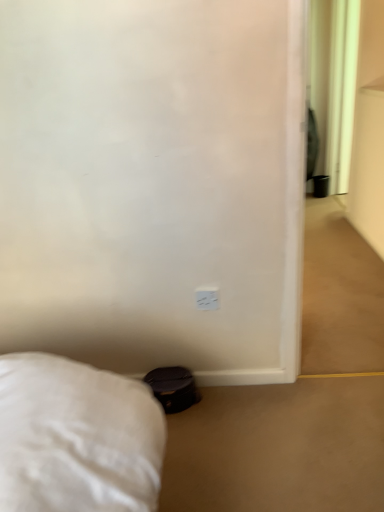
At what (x,y) coordinates should I click in order to perform the action: click on white glossy electric outlet at center. Please return your answer as a coordinate pair (x, y). This screenshot has width=384, height=512. Looking at the image, I should click on (207, 298).

Describe the element at coordinates (207, 298) in the screenshot. I see `white glossy electric outlet at center` at that location.

Where is `white glossy electric outlet at center`? The height and width of the screenshot is (512, 384). white glossy electric outlet at center is located at coordinates (207, 298).